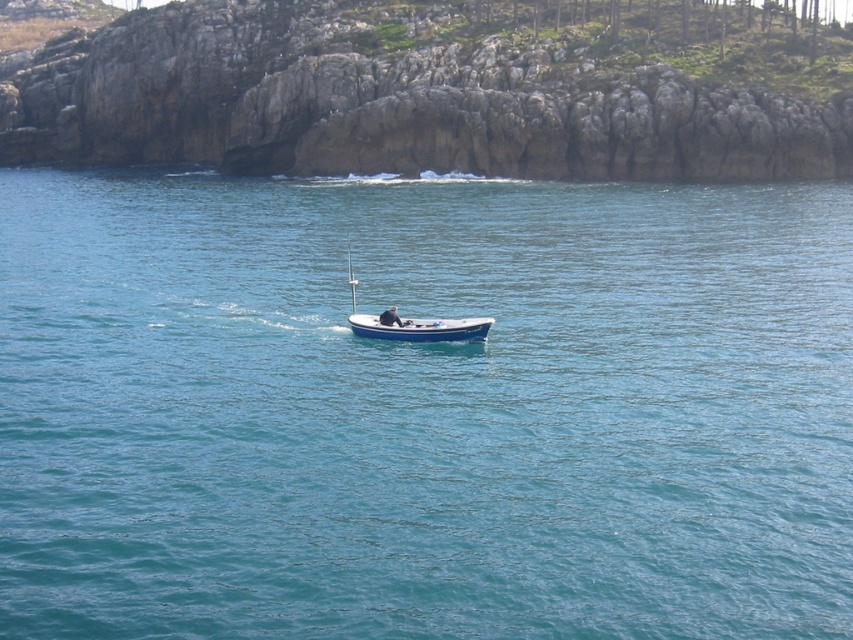
Question: Which of the following is the closest to the observer?

Choices:
 (A) (383, 323)
 (B) (469, 326)
 (C) (848, 612)

Answer: (C)

Question: Is blue polished wood boat at center thinner than light brown leather jacket at center?

Choices:
 (A) yes
 (B) no

Answer: (B)

Question: Among these objects, which one is nearest to the camera?

Choices:
 (A) blue polished wood boat at center
 (B) light brown leather jacket at center

Answer: (A)

Question: Among these points, which one is farthest from the camera?

Choices:
 (A) (469, 332)
 (B) (274, 458)

Answer: (A)

Question: Does blue polished wood boat at center appear on the right side of light brown leather jacket at center?

Choices:
 (A) no
 (B) yes

Answer: (A)

Question: Does blue water at center have a larger size compared to light brown leather jacket at center?

Choices:
 (A) yes
 (B) no

Answer: (A)